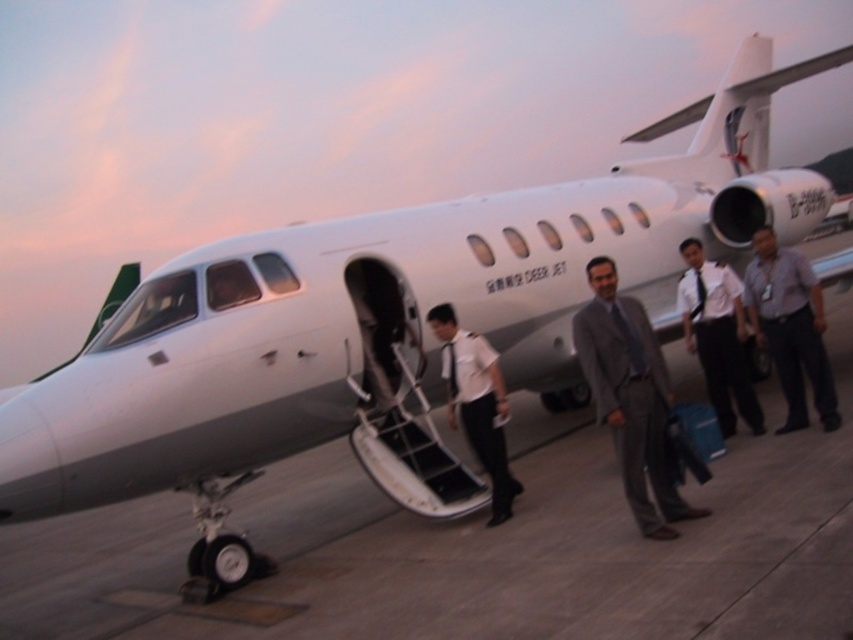
Question: Among these objects, which one is farthest from the camera?

Choices:
 (A) white uniform at center
 (B) gray suit at center
 (C) gray concrete tarmac at center

Answer: (A)

Question: Is gray concrete tarmac at center thinner than white uniform at center?

Choices:
 (A) no
 (B) yes

Answer: (A)

Question: Which point is farther to the camera?

Choices:
 (A) (726, 419)
 (B) (492, 408)
 (C) (572, 317)

Answer: (C)

Question: Where is gray uniformed man at center located in relation to white uniform at center in the image?

Choices:
 (A) below
 (B) above

Answer: (B)

Question: Does gray concrete tarmac at center appear on the left side of white uniform at center?

Choices:
 (A) no
 (B) yes

Answer: (B)

Question: Estimate the real-world distances between objects in this image. Which object is closer to the gray suit at center?

Choices:
 (A) gray concrete tarmac at center
 (B) gray uniformed man at center
 (C) white uniform at center

Answer: (C)